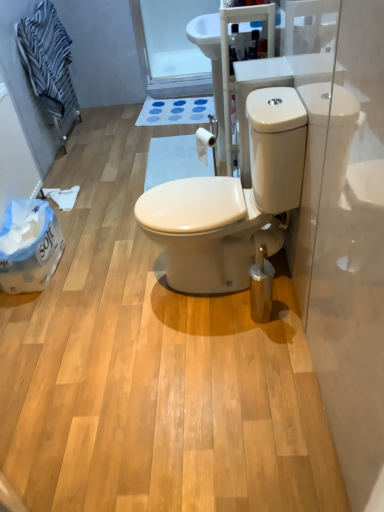
Question: From a real-world perspective, is transparent glass door at upper center under white glossy toilet at center?

Choices:
 (A) no
 (B) yes

Answer: (B)

Question: Does transparent glass door at upper center appear on the left side of white glossy toilet at center?

Choices:
 (A) yes
 (B) no

Answer: (A)

Question: From the image's perspective, is transparent glass door at upper center located above white glossy toilet at center?

Choices:
 (A) yes
 (B) no

Answer: (A)

Question: Does transparent glass door at upper center have a greater width compared to white glossy toilet at center?

Choices:
 (A) no
 (B) yes

Answer: (A)

Question: From the image's perspective, is transparent glass door at upper center under white glossy toilet at center?

Choices:
 (A) no
 (B) yes

Answer: (A)

Question: Would you say white matte toilet paper at upper center is inside or outside blue striped towel at upper left?

Choices:
 (A) outside
 (B) inside

Answer: (A)

Question: Is point (200, 132) positioned closer to the camera than point (56, 110)?

Choices:
 (A) farther
 (B) closer

Answer: (B)

Question: Relative to blue striped towel at upper left, is white matte toilet paper at upper center in front or behind?

Choices:
 (A) front
 (B) behind

Answer: (A)

Question: Considering the positions of white matte toilet paper at upper center and blue striped towel at upper left in the image, is white matte toilet paper at upper center taller or shorter than blue striped towel at upper left?

Choices:
 (A) tall
 (B) short

Answer: (B)

Question: Is transparent glass door at upper center taller or shorter than blue rubber bath mat at center?

Choices:
 (A) short
 (B) tall

Answer: (B)

Question: Does point (173, 68) appear closer or farther from the camera than point (173, 103)?

Choices:
 (A) closer
 (B) farther

Answer: (B)

Question: From a real-world perspective, relative to blue rubber bath mat at center, is transparent glass door at upper center vertically above or below?

Choices:
 (A) below
 (B) above

Answer: (B)

Question: From the image's perspective, is transparent glass door at upper center positioned above or below blue rubber bath mat at center?

Choices:
 (A) below
 (B) above

Answer: (B)

Question: Relative to blue striped towel at upper left, is white plastic bag at left in front or behind?

Choices:
 (A) behind
 (B) front

Answer: (B)

Question: From the image's perspective, relative to blue striped towel at upper left, is white plastic bag at left above or below?

Choices:
 (A) above
 (B) below

Answer: (B)